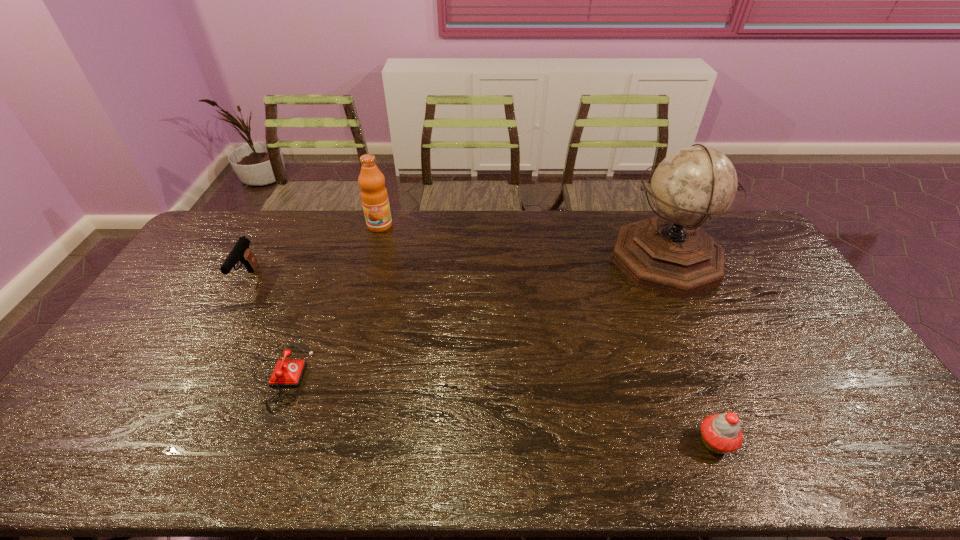
Locate an element on the screen. The height and width of the screenshot is (540, 960). vacant space at the right edge of the desktop is located at coordinates (825, 404).

This screenshot has height=540, width=960. Identify the location of vacant region between the fruit juice and the telephone. (328, 301).

Image resolution: width=960 pixels, height=540 pixels. Identify the location of unoccupied area between the cupcake and the globe. (690, 351).

This screenshot has width=960, height=540. In order to click on vacant space that's between the nearest object and the third object from left to right in this screenshot , I will do `click(547, 334)`.

Locate an element on the screen. vacant space in between the leftmost object and the fourth shortest object is located at coordinates (314, 253).

You are a GUI agent. You are given a task and a screenshot of the screen. Output one action in this format:
    pyautogui.click(x=<x>, y=<y>)
    Task: Click on the empty space that is in between the pistol and the second object from left to right
    
    Given the screenshot: What is the action you would take?
    pyautogui.click(x=262, y=327)

Image resolution: width=960 pixels, height=540 pixels. Identify the location of unoccupied area between the second nearest object and the fourth shortest object. (328, 301).

The height and width of the screenshot is (540, 960). I want to click on free space between the fourth shortest object and the tallest object, so click(523, 243).

Locate an element on the screen. vacant region between the third object from right to left and the second object from left to right is located at coordinates (328, 301).

Where is `vacant region between the globe and the leftmost object`? Image resolution: width=960 pixels, height=540 pixels. vacant region between the globe and the leftmost object is located at coordinates (457, 269).